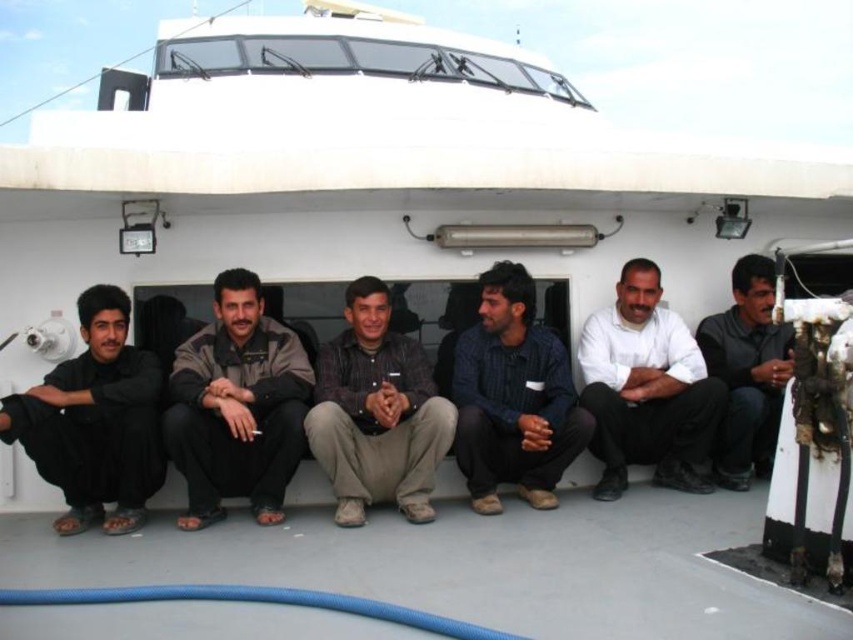
Is point (335, 346) closer to camera compared to point (735, 284)?

Yes, point (335, 346) is in front of point (735, 284).

Is brown textured shirt at center thinner than black matte shirt at center?

No, brown textured shirt at center is not thinner than black matte shirt at center.

The width and height of the screenshot is (853, 640). I want to click on brown textured shirt at center, so click(376, 412).

Which is below, brown textured shirt at center or white matte shirt at center?

brown textured shirt at center

Between point (329, 452) and point (672, 440), which one is positioned in front?

Point (329, 452) is in front.

In order to click on brown textured shirt at center in this screenshot , I will do `click(376, 412)`.

I want to click on brown textured shirt at center, so coord(376,412).

Can you confirm if brown leather jacket at center is smaller than white matte shirt at center?

Actually, brown leather jacket at center might be larger than white matte shirt at center.

Does brown leather jacket at center have a lesser width compared to white matte shirt at center?

Yes, brown leather jacket at center is thinner than white matte shirt at center.

Identify the location of brown leather jacket at center. (236, 406).

Where is `brown leather jacket at center`? This screenshot has height=640, width=853. brown leather jacket at center is located at coordinates (236, 406).